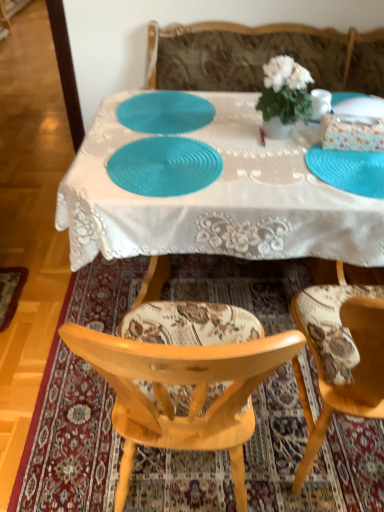
At what (x,y) coordinates should I click in order to perform the action: click on free point below blue textured placemat at center, the 1th plate positioned from the left (from a real-world perspective). Please return your answer as a coordinate pair (x, y). The width and height of the screenshot is (384, 512). Looking at the image, I should click on (165, 111).